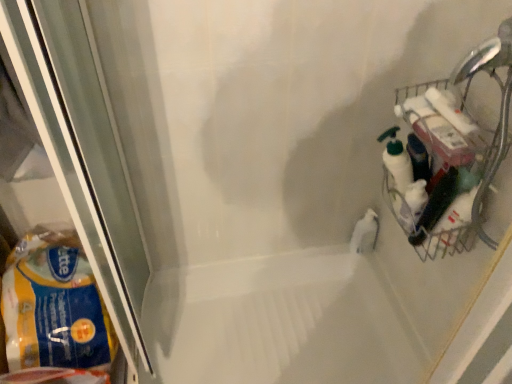
Question: Is yellow plastic bag at left positioned before metallic wire basket at right?

Choices:
 (A) yes
 (B) no

Answer: (B)

Question: From a real-world perspective, is yellow plastic bag at left on metallic wire basket at right?

Choices:
 (A) yes
 (B) no

Answer: (B)

Question: Considering the relative sizes of yellow plastic bag at left and metallic wire basket at right in the image provided, is yellow plastic bag at left wider than metallic wire basket at right?

Choices:
 (A) no
 (B) yes

Answer: (B)

Question: Is metallic wire basket at right at the back of yellow plastic bag at left?

Choices:
 (A) no
 (B) yes

Answer: (A)

Question: Can you confirm if yellow plastic bag at left is smaller than metallic wire basket at right?

Choices:
 (A) no
 (B) yes

Answer: (A)

Question: From the image's perspective, relative to metallic wire basket at right, is white glossy bath at center above or below?

Choices:
 (A) above
 (B) below

Answer: (B)

Question: Considering the positions of white glossy bath at center and metallic wire basket at right in the image, is white glossy bath at center wider or thinner than metallic wire basket at right?

Choices:
 (A) wide
 (B) thin

Answer: (A)

Question: Visually, is white glossy bath at center positioned to the left or to the right of metallic wire basket at right?

Choices:
 (A) right
 (B) left

Answer: (B)

Question: Is white glossy bath at center spatially inside metallic wire basket at right, or outside of it?

Choices:
 (A) outside
 (B) inside

Answer: (A)

Question: Is white glossy bath at center in front of or behind yellow plastic bag at left in the image?

Choices:
 (A) behind
 (B) front

Answer: (A)

Question: From their relative heights in the image, would you say white glossy bath at center is taller or shorter than yellow plastic bag at left?

Choices:
 (A) tall
 (B) short

Answer: (B)

Question: Do you think white glossy bath at center is within yellow plastic bag at left, or outside of it?

Choices:
 (A) outside
 (B) inside

Answer: (A)

Question: Considering the positions of white glossy bath at center and yellow plastic bag at left in the image, is white glossy bath at center wider or thinner than yellow plastic bag at left?

Choices:
 (A) thin
 (B) wide

Answer: (B)

Question: Does point (365, 221) appear closer or farther from the camera than point (475, 178)?

Choices:
 (A) farther
 (B) closer

Answer: (A)

Question: From their relative heights in the image, would you say white glossy bottle at center is taller or shorter than metallic wire basket at right?

Choices:
 (A) tall
 (B) short

Answer: (B)